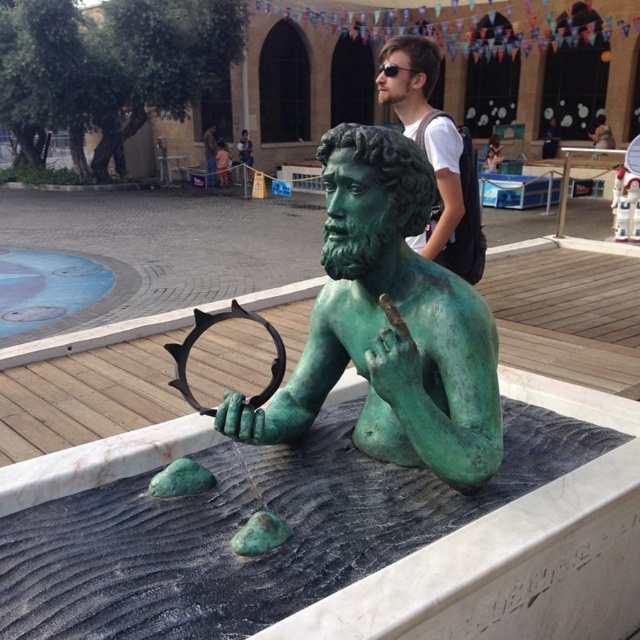
Question: Which is farther from the matte green statue at upper center?

Choices:
 (A) green patina bronze statue at center
 (B) matte green statue at center

Answer: (B)

Question: Which point is farther to the camera?

Choices:
 (A) (214, 160)
 (B) (472, 202)
 (C) (339, 250)

Answer: (A)

Question: Does matte green statue at upper center have a lesser width compared to matte green statue at center?

Choices:
 (A) yes
 (B) no

Answer: (B)

Question: Does green patina bronze statue at center appear under matte green statue at center?

Choices:
 (A) yes
 (B) no

Answer: (A)

Question: Estimate the real-world distances between objects in this image. Which object is farther from the matte green statue at upper center?

Choices:
 (A) green patina bronze statue at center
 (B) matte green statue at center

Answer: (B)

Question: Can you confirm if matte green statue at upper center is positioned to the right of matte green statue at center?

Choices:
 (A) yes
 (B) no

Answer: (A)